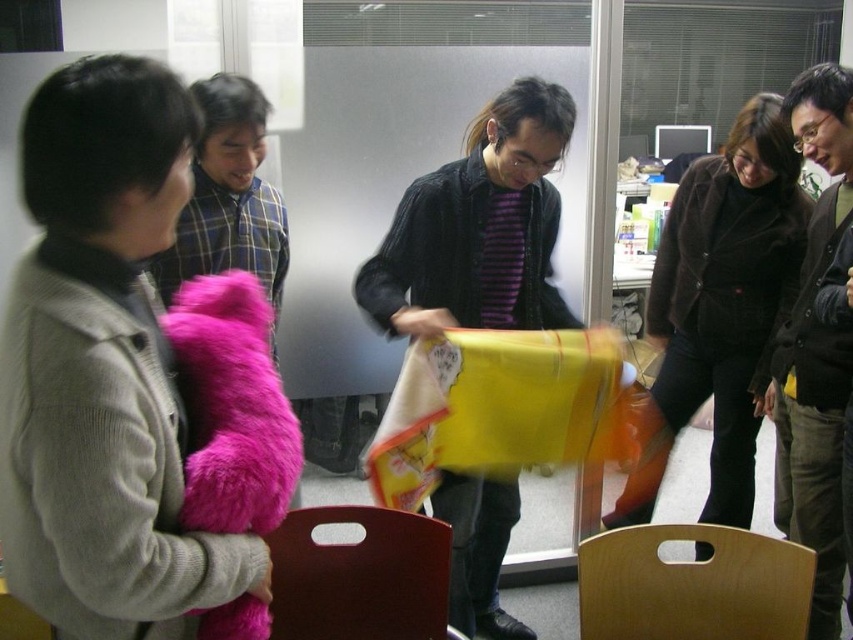
You are a delivery robot that needs to place a small package between the fuzzy pink teddy bear at left and the plaid shirt at upper left. The package requires at least 1 meter of space to be placed safely. Can you fit it there?

The distance between the fuzzy pink teddy bear at left and the plaid shirt at upper left is 75.37 centimeters, which is less than 1 meter. Therefore, the package cannot be placed safely between them.

You are trying to determine the spatial relationship between the fuzzy pink teddy bear at left and the plaid shirt at upper left. Which object has a smaller width?

The fuzzy pink teddy bear at left has a smaller width than the plaid shirt at upper left because it is thinner.

From the picture: You are organizing a charity event and need to decide which items to display. The fuzzy pink teddy bear at left and the plaid shirt at upper left are both candidates. Based on their sizes, which item would require less space for display?

The fuzzy pink teddy bear at left has a smaller size compared to the plaid shirt at upper left, so it would require less space for display.